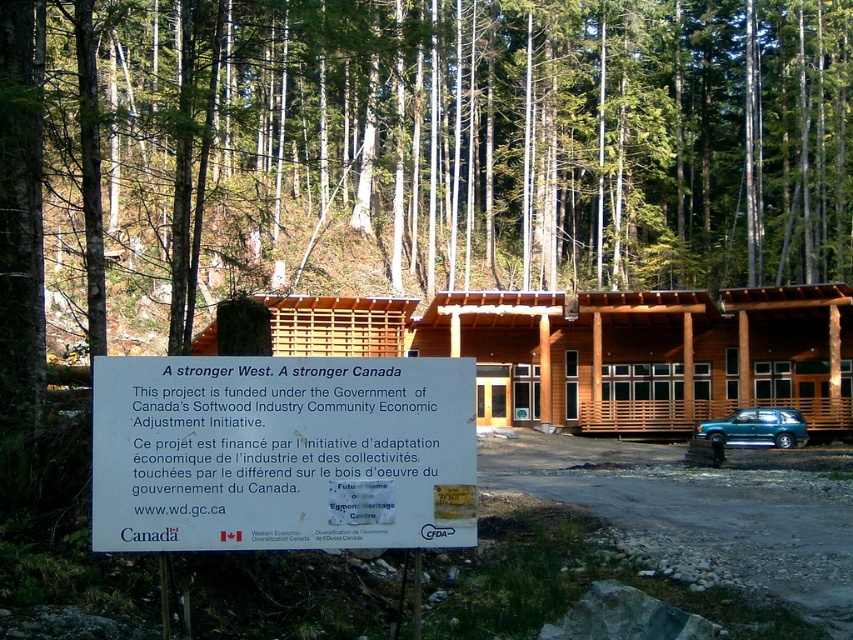
You are standing in the forest and see the white paper sign at center. If you walk directly towards the sign, will you first encounter the trees or the sign?

The white paper sign at center is positioned at point (x=282, y=452), which is in the foreground of the scene. Since the sign is in the foreground, you would encounter the white paper sign at center before reaching the trees in the background.

You are a visitor at the forest area and want to take a photo of the wooden cabin at center and the teal glossy car at lower right. Which object should you focus on first if you want to capture both in a single frame without moving the camera?

The wooden cabin at center is positioned over the teal glossy car at lower right, so you should focus on the wooden cabin at center first to ensure it remains in focus while the teal glossy car at lower right will naturally be in the background of the frame.

You are standing in the forest looking at the wooden building in the background. There are two points marked on the ground. The first point is at coordinates point (425, 522) and the second point is at point (454, 355). Which point is closer to you?

Point (425, 522) is in front of point (454, 355), so it is closer to you.